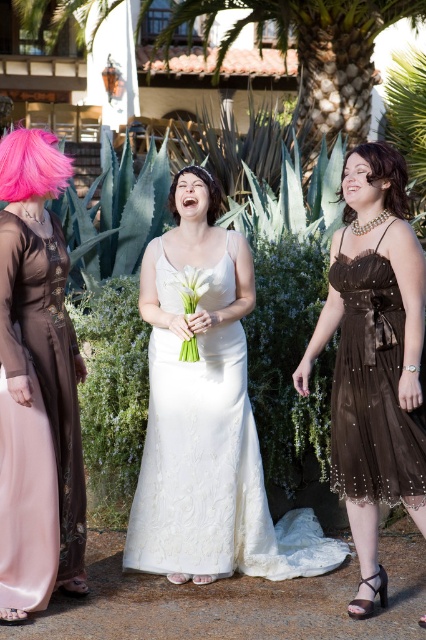
You are a photographer setting up for the wedding photoshoot. You need to position a backdrop that is 1.8 meters wide behind the brown satin dress at center and the brown shiny hair at upper right. Will the backdrop be wide enough to cover both objects without any overlap?

The brown satin dress at center is wider than the brown shiny hair at upper right. Since the backdrop is 1.8 meters wide, it should be sufficient to cover both objects as long as their combined width does not exceed the backdrop width. However, since the exact individual widths are not provided, we can only confirm that the dress is wider, but the total required space depends on their actual measurements.

You are a photographer setting up for the wedding photoshoot. You need to ensure that the ivory satin dress at center and the pink fluffy wig at upper left are both visible in the frame. Based on their heights, which object should you adjust the camera angle to focus on first?

The ivory satin dress at center is taller than the pink fluffy wig at upper left, so you should focus on the ivory satin dress at center first to ensure it is centered and in focus before adjusting for the smaller pink fluffy wig at upper left.